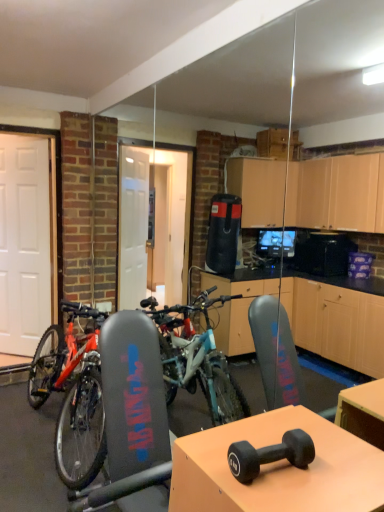
What do you see at coordinates (72, 390) in the screenshot?
I see `teal matte bicycle at center` at bounding box center [72, 390].

What do you see at coordinates (270, 455) in the screenshot?
I see `black rubber dumbbell at center` at bounding box center [270, 455].

Measure the distance between white matte door at left and camera.

3.67 meters.

This screenshot has width=384, height=512. In order to click on white matte door at left in this screenshot , I will do click(26, 242).

At what (x,y) coordinates should I click in order to perform the action: click on teal matte bicycle at center. Please return your answer as a coordinate pair (x, y). This screenshot has height=512, width=384. Looking at the image, I should click on (72, 390).

Is teal matte bicycle at center at the back of white matte door at left?

No, white matte door at left's orientation is not away from teal matte bicycle at center.

Considering the sizes of objects white matte door at left and teal matte bicycle at center in the image provided, who is thinner, white matte door at left or teal matte bicycle at center?

white matte door at left.

Is white matte door at left with teal matte bicycle at center?

No, white matte door at left is not with teal matte bicycle at center.

Which object is closer to the camera taking this photo, white matte door at left or teal matte bicycle at center?

teal matte bicycle at center is more forward.

From a real-world perspective, does white matte door at left sit lower than black rubber dumbbell at center?

No, from a real-world perspective, white matte door at left is not below black rubber dumbbell at center.

Is white matte door at left positioned far away from black rubber dumbbell at center?

white matte door at left is far away from black rubber dumbbell at center.

Is white matte door at left to the left of black rubber dumbbell at center from the viewer's perspective?

Indeed, white matte door at left is positioned on the left side of black rubber dumbbell at center.

From the image's perspective, is white matte door at left on top of black rubber dumbbell at center?

Correct, white matte door at left appears higher than black rubber dumbbell at center in the image.

From the picture: Considering the relative sizes of teal matte bicycle at center and matte black dumbbell at center in the image provided, is teal matte bicycle at center shorter than matte black dumbbell at center?

In fact, teal matte bicycle at center may be taller than matte black dumbbell at center.

Which of these two, teal matte bicycle at center or matte black dumbbell at center, is thinner?

matte black dumbbell at center is thinner.

Is teal matte bicycle at center positioned before matte black dumbbell at center?

No.

Is black rubber dumbbell at center touching teal matte bicycle at center?

They are not placed beside each other.

Where is `dumbbell in front of the teal matte bicycle at center`? dumbbell in front of the teal matte bicycle at center is located at coordinates (270, 455).

Considering the points (297, 443) and (82, 340), which point is in front, point (297, 443) or point (82, 340)?

Positioned in front is point (297, 443).

The height and width of the screenshot is (512, 384). What are the coordinates of `dumbbell above the matte black dumbbell at center (from the image's perspective)` in the screenshot? It's located at (270, 455).

Who is more distant, black rubber dumbbell at center or matte black dumbbell at center?

Positioned behind is black rubber dumbbell at center.

From a real-world perspective, which is physically below, black rubber dumbbell at center or matte black dumbbell at center?

matte black dumbbell at center, from a real-world perspective.

Do you think black rubber dumbbell at center is within matte black dumbbell at center, or outside of it?

black rubber dumbbell at center is spatially situated outside matte black dumbbell at center.

Between point (21, 234) and point (181, 444), which one is positioned behind?

The point (21, 234) is behind.

Where is `garage door behind the matte black dumbbell at center`? The width and height of the screenshot is (384, 512). garage door behind the matte black dumbbell at center is located at coordinates (26, 242).

Visually, is white matte door at left positioned to the left or to the right of matte black dumbbell at center?

From the image, it's evident that white matte door at left is to the left of matte black dumbbell at center.

Is the surface of white matte door at left in direct contact with matte black dumbbell at center?

white matte door at left and matte black dumbbell at center are not in contact.

Is matte black dumbbell at center in front of white matte door at left?

That is True.

Is matte black dumbbell at center not near white matte door at left?

matte black dumbbell at center is far away from white matte door at left.

Is matte black dumbbell at center outside of white matte door at left?

Yes, matte black dumbbell at center is not within white matte door at left.

From the image's perspective, does matte black dumbbell at center appear higher than white matte door at left?

No, from the image's perspective, matte black dumbbell at center is not on top of white matte door at left.

Locate an element on the screen. The width and height of the screenshot is (384, 512). bicycle in front of the white matte door at left is located at coordinates (72, 390).

Image resolution: width=384 pixels, height=512 pixels. In order to click on garage door behind the black rubber dumbbell at center in this screenshot , I will do `click(26, 242)`.

Based on their spatial positions, is teal matte bicycle at center or white matte door at left closer to matte black dumbbell at center?

Among the two, teal matte bicycle at center is located nearer to matte black dumbbell at center.

From the image, which object appears to be nearer to black rubber dumbbell at center, matte black dumbbell at center or teal matte bicycle at center?

matte black dumbbell at center is closer to black rubber dumbbell at center.

Based on the photo, looking at the image, which one is located closer to teal matte bicycle at center, white matte door at left or black rubber dumbbell at center?

white matte door at left.

Looking at the image, which one is located closer to white matte door at left, teal matte bicycle at center or matte black dumbbell at center?

The object closer to white matte door at left is teal matte bicycle at center.

Which object lies nearer to the anchor point black rubber dumbbell at center, teal matte bicycle at center or white matte door at left?

Based on the image, teal matte bicycle at center appears to be nearer to black rubber dumbbell at center.

When comparing their distances from matte black dumbbell at center, does white matte door at left or teal matte bicycle at center seem closer?

Based on the image, teal matte bicycle at center appears to be nearer to matte black dumbbell at center.

Considering their positions, is black rubber dumbbell at center positioned further to teal matte bicycle at center than white matte door at left?

black rubber dumbbell at center is further to teal matte bicycle at center.

Based on their spatial positions, is black rubber dumbbell at center or white matte door at left further from matte black dumbbell at center?

white matte door at left lies further to matte black dumbbell at center than the other object.

You are a GUI agent. You are given a task and a screenshot of the screen. Output one action in this format:
    pyautogui.click(x=<x>, y=<y>)
    Task: Click on the bicycle between matte black dumbbell at center and white matte door at left along the z-axis
    This screenshot has height=512, width=384.
    Given the screenshot: What is the action you would take?
    pyautogui.click(x=72, y=390)

Where is `dumbbell between matte black dumbbell at center and white matte door at left from front to back`? dumbbell between matte black dumbbell at center and white matte door at left from front to back is located at coordinates (270, 455).

This screenshot has width=384, height=512. What are the coordinates of `dumbbell located between teal matte bicycle at center and matte black dumbbell at center in the left-right direction` in the screenshot? It's located at (270, 455).

You are a GUI agent. You are given a task and a screenshot of the screen. Output one action in this format:
    pyautogui.click(x=<x>, y=<y>)
    Task: Click on the bicycle between black rubber dumbbell at center and white matte door at left from front to back
    This screenshot has width=384, height=512.
    Given the screenshot: What is the action you would take?
    pyautogui.click(x=72, y=390)